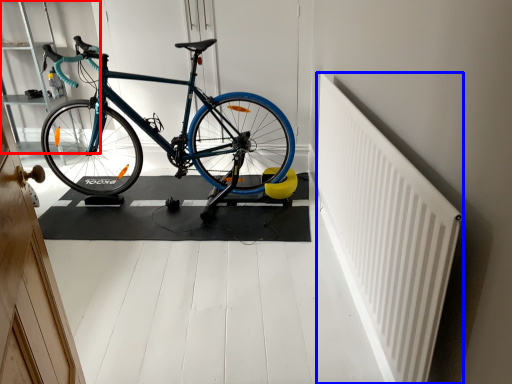
Question: Which point is further to the camera, shelf (highlighted by a red box) or radiator (highlighted by a blue box)?

Choices:
 (A) shelf
 (B) radiator

Answer: (A)